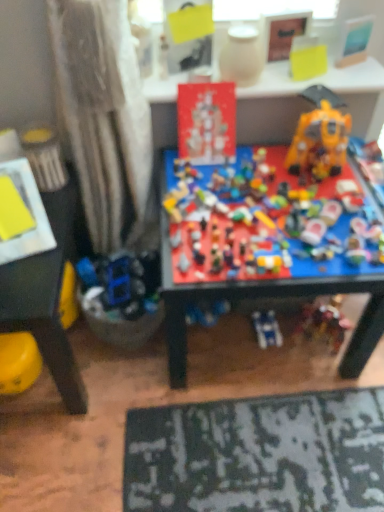
This screenshot has width=384, height=512. In order to click on vacant location below multicolored plastic toys at center, the 3th toy viewed from the right (from a real-world perspective) in this screenshot , I will do `click(261, 228)`.